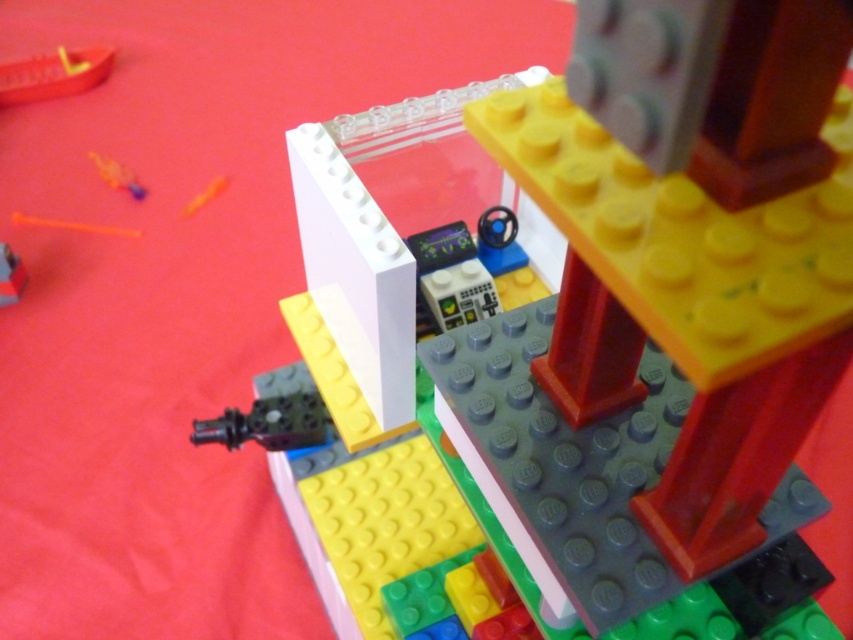
Which of these two, smooth orange boat at upper left or matte black brick at lower left, stands taller?

Standing taller between the two is smooth orange boat at upper left.

Identify the location of smooth orange boat at upper left. This screenshot has height=640, width=853. (53, 74).

What do you see at coordinates (53, 74) in the screenshot? The image size is (853, 640). I see `smooth orange boat at upper left` at bounding box center [53, 74].

Where is `smooth orange boat at upper left`? This screenshot has width=853, height=640. smooth orange boat at upper left is located at coordinates click(53, 74).

Can you confirm if smooth orange boat at upper left is positioned below translucent plastic toy at upper left?

Incorrect, smooth orange boat at upper left is not positioned below translucent plastic toy at upper left.

Is smooth orange boat at upper left thinner than translucent plastic toy at upper left?

No, smooth orange boat at upper left is not thinner than translucent plastic toy at upper left.

Identify the location of smooth orange boat at upper left. Image resolution: width=853 pixels, height=640 pixels. (53, 74).

Between matte black brick at lower left and translucent plastic toy at upper left, which one is positioned higher?

translucent plastic toy at upper left

Does matte black brick at lower left lie in front of translucent plastic toy at upper left?

Yes, matte black brick at lower left is in front of translucent plastic toy at upper left.

Is point (6, 288) farther from viewer compared to point (125, 186)?

No, it is not.

This screenshot has height=640, width=853. I want to click on matte black brick at lower left, so click(9, 275).